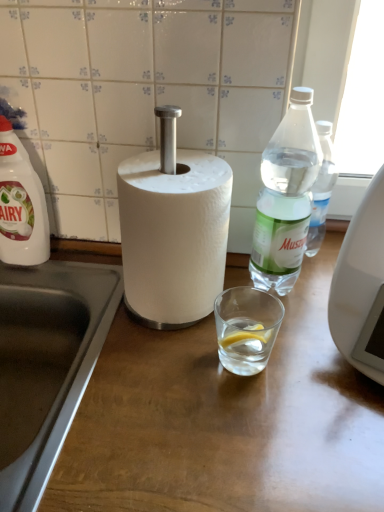
You are a GUI agent. You are given a task and a screenshot of the screen. Output one action in this format:
    pyautogui.click(x=<x>, y=<y>)
    Task: Click on the stainless steel sink at lower left
    
    Given the screenshot: What is the action you would take?
    pyautogui.click(x=55, y=356)

Find the location of a particular element. wooden at center is located at coordinates (226, 420).

The height and width of the screenshot is (512, 384). What do you see at coordinates (226, 420) in the screenshot? I see `wooden at center` at bounding box center [226, 420].

Find the location of a particular element. white plastic bottle at left, the first bottle viewed from the left is located at coordinates (21, 204).

Is clear plastic bottle at right, the 2th bottle viewed from the left, inside stainless steel sink at lower left?

No, clear plastic bottle at right, the 2th bottle viewed from the left, is located outside of stainless steel sink at lower left.

Is stainless steel sink at lower left behind clear plastic bottle at right, marked as the first bottle in a right-to-left arrangement?

No, it is not.

From a real-world perspective, is stainless steel sink at lower left beneath clear plastic bottle at right, the 2th bottle viewed from the left?

Yes, from a real-world perspective, stainless steel sink at lower left is under clear plastic bottle at right, the 2th bottle viewed from the left.

Looking at this image, does stainless steel sink at lower left appear on the right side of clear plastic bottle at right, the 2th bottle viewed from the left?

Incorrect, stainless steel sink at lower left is not on the right side of clear plastic bottle at right, the 2th bottle viewed from the left.

Does wooden at center lie in front of white plastic bottle at left, the first bottle viewed from the left?

Yes, it is in front of white plastic bottle at left, the first bottle viewed from the left.

Is wooden at center spatially inside white plastic bottle at left, the first bottle viewed from the left, or outside of it?

wooden at center exists outside the volume of white plastic bottle at left, the first bottle viewed from the left.

Considering the sizes of objects wooden at center and white plastic bottle at left, the first bottle viewed from the left, in the image provided, who is taller, wooden at center or white plastic bottle at left, the first bottle viewed from the left,?

wooden at center.

Is white plastic bottle at left, the first bottle viewed from the left, at the left side of wooden at center?

Yes, white plastic bottle at left, the first bottle viewed from the left, is to the left of wooden at center.

Is wooden at center at the back of white plastic bottle at left, the first bottle viewed from the left?

No, wooden at center is not at the back of white plastic bottle at left, the first bottle viewed from the left.

Is white plastic bottle at left, the first bottle viewed from the left, with wooden at center?

white plastic bottle at left, the first bottle viewed from the left, and wooden at center are clearly separated.

Can you confirm if white plastic bottle at left, the first bottle viewed from the left, is thinner than wooden at center?

Yes, white plastic bottle at left, the first bottle viewed from the left, is thinner than wooden at center.

Between wooden at center and stainless steel sink at lower left, which one has smaller width?

Thinner between the two is stainless steel sink at lower left.

In the image, is wooden at center on the left side or the right side of stainless steel sink at lower left?

wooden at center is positioned on stainless steel sink at lower left's right side.

Relative to stainless steel sink at lower left, is wooden at center in front or behind?

Visually, wooden at center is located in front of stainless steel sink at lower left.

From the picture: Between clear plastic bottle at right, marked as the first bottle in a right-to-left arrangement, and stainless steel sink at lower left, which one has smaller width?

clear plastic bottle at right, marked as the first bottle in a right-to-left arrangement.

In the scene shown: Would you say stainless steel sink at lower left is part of clear plastic bottle at right, the 2th bottle viewed from the left,'s contents?

No, clear plastic bottle at right, the 2th bottle viewed from the left, does not contain stainless steel sink at lower left.

Which point is more forward, [307,194] or [64,381]?

The point [64,381] is closer.

Which of these two, wooden at center or clear plastic bottle at right, the 2th bottle viewed from the left, is wider?

wooden at center.

Does wooden at center lie in front of clear plastic bottle at right, the 2th bottle viewed from the left?

Yes, the depth of wooden at center is less than that of clear plastic bottle at right, the 2th bottle viewed from the left.

Choose the correct answer: Is wooden at center inside clear plastic bottle at right, marked as the first bottle in a right-to-left arrangement, or outside it?

wooden at center is outside clear plastic bottle at right, marked as the first bottle in a right-to-left arrangement.

Which point is more distant from viewer, (292,305) or (267,184)?

The point (267,184) is more distant.

Find the location of a particular element. Image resolution: width=384 pixels, height=512 pixels. bottle that is the 1st one when counting upward from the stainless steel sink at lower left (from the image's perspective) is located at coordinates (21, 204).

Can you confirm if stainless steel sink at lower left is taller than white plastic bottle at left, the first bottle viewed from the left?

In fact, stainless steel sink at lower left may be shorter than white plastic bottle at left, the first bottle viewed from the left.

From the picture: Which object is more forward, stainless steel sink at lower left or white plastic bottle at left, marked as the second bottle in a right-to-left arrangement?

stainless steel sink at lower left is closer to the camera.

Is stainless steel sink at lower left situated inside white plastic bottle at left, the first bottle viewed from the left, or outside?

stainless steel sink at lower left lies outside white plastic bottle at left, the first bottle viewed from the left.

The width and height of the screenshot is (384, 512). What are the coordinates of `sink that appears below the clear plastic bottle at right, marked as the first bottle in a right-to-left arrangement (from the image's perspective)` in the screenshot? It's located at (55, 356).

From the image's perspective, starting from the wooden at center, which bottle is the 1st one above? Please provide its 2D coordinates.

[(21, 204)]

From the image, which object appears to be nearer to clear plastic bottle at right, marked as the first bottle in a right-to-left arrangement, stainless steel sink at lower left or white plastic bottle at left, the first bottle viewed from the left?

Based on the image, stainless steel sink at lower left appears to be nearer to clear plastic bottle at right, marked as the first bottle in a right-to-left arrangement.

From the image, which object appears to be nearer to white plastic bottle at left, the first bottle viewed from the left, stainless steel sink at lower left or clear plastic bottle at right, the 2th bottle viewed from the left?

stainless steel sink at lower left lies closer to white plastic bottle at left, the first bottle viewed from the left, than the other object.

From the image, which object appears to be nearer to clear plastic bottle at right, the 2th bottle viewed from the left, wooden at center or white plastic bottle at left, the first bottle viewed from the left?

The object closer to clear plastic bottle at right, the 2th bottle viewed from the left, is wooden at center.

Based on their spatial positions, is clear plastic bottle at right, marked as the first bottle in a right-to-left arrangement, or wooden at center closer to stainless steel sink at lower left?

Result: wooden at center is closer to stainless steel sink at lower left.

Consider the image. From the image, which object appears to be farther from white plastic bottle at left, the first bottle viewed from the left, clear plastic bottle at right, marked as the first bottle in a right-to-left arrangement, or stainless steel sink at lower left?

clear plastic bottle at right, marked as the first bottle in a right-to-left arrangement, is further to white plastic bottle at left, the first bottle viewed from the left.

When comparing their distances from wooden at center, does white plastic bottle at left, the first bottle viewed from the left, or stainless steel sink at lower left seem closer?

Among the two, stainless steel sink at lower left is located nearer to wooden at center.

From the image, which object appears to be farther from stainless steel sink at lower left, wooden at center or clear plastic bottle at right, the 2th bottle viewed from the left?

clear plastic bottle at right, the 2th bottle viewed from the left.

When comparing their distances from stainless steel sink at lower left, does clear plastic bottle at right, the 2th bottle viewed from the left, or white plastic bottle at left, the first bottle viewed from the left, seem further?

clear plastic bottle at right, the 2th bottle viewed from the left, is further to stainless steel sink at lower left.

I want to click on bottle between clear plastic bottle at right, the 2th bottle viewed from the left, and wooden at center from top to bottom, so click(21, 204).

Find the location of `sink situated between white plastic bottle at left, the first bottle viewed from the left, and clear plastic bottle at right, the 2th bottle viewed from the left, from left to right`. sink situated between white plastic bottle at left, the first bottle viewed from the left, and clear plastic bottle at right, the 2th bottle viewed from the left, from left to right is located at coordinates (55, 356).

Where is `sink between white plastic bottle at left, the first bottle viewed from the left, and wooden at center from top to bottom`? This screenshot has width=384, height=512. sink between white plastic bottle at left, the first bottle viewed from the left, and wooden at center from top to bottom is located at coordinates (55, 356).

Locate an element on the screen. This screenshot has height=512, width=384. sink between clear plastic bottle at right, the 2th bottle viewed from the left, and wooden at center, in the vertical direction is located at coordinates (x=55, y=356).